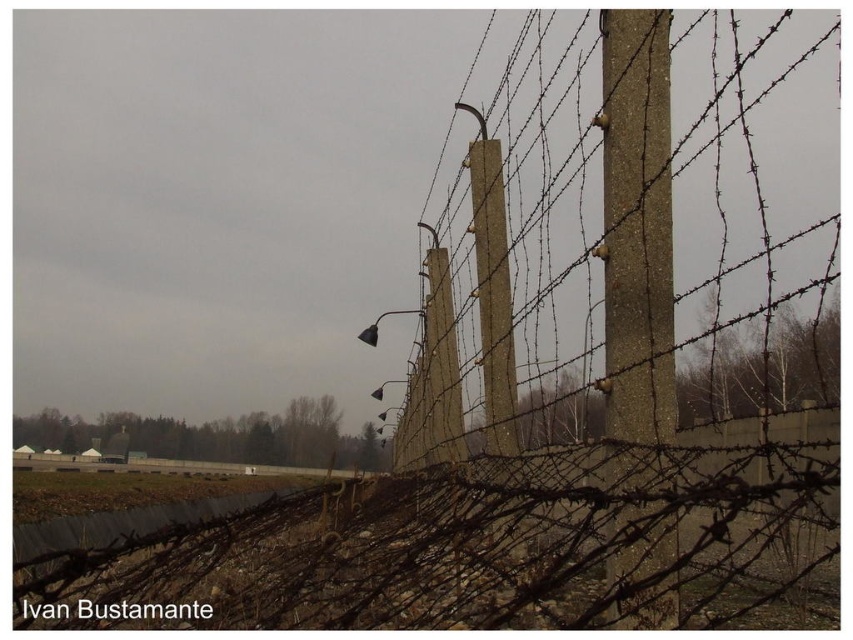
You are a maintenance worker assessing the barbed wire fence. You notice the concrete wire at center and the concrete textured pole at center. Which object has a greater width?

The concrete wire at center has a greater width than the concrete textured pole at center, as stated in the description.

You are a maintenance worker inspecting the fence. You notice the concrete wire at center and the concrete textured pole at center. Which one is taller?

The concrete wire at center is taller than the concrete textured pole at center.

You are a maintenance worker inspecting the fence. You notice the concrete wire at center and the concrete textured pole at center. Which object is positioned higher in the image?

The concrete wire at center is above the concrete textured pole at center, so the concrete wire at center is positioned higher.